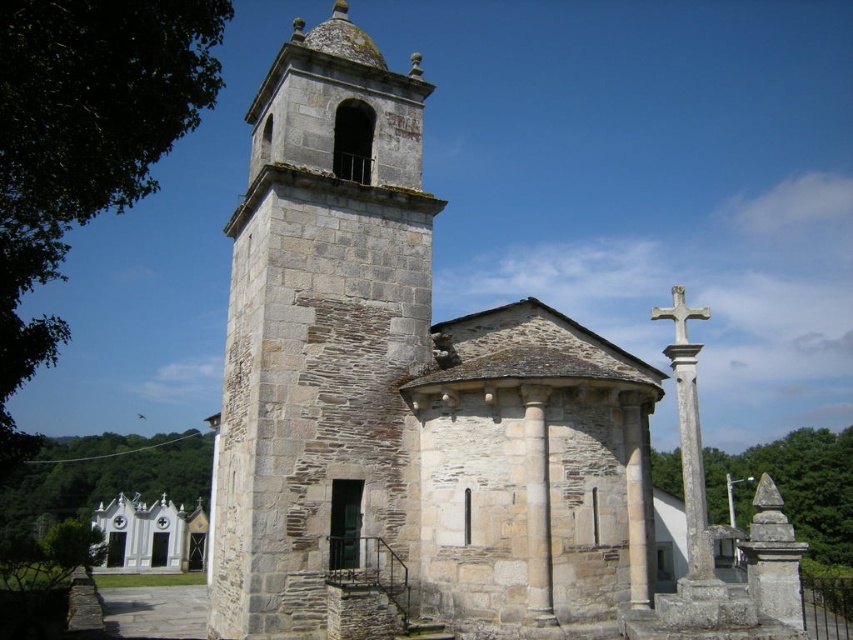
Who is taller, gray stone tower at center or white stone cross at upper right?

Standing taller between the two is gray stone tower at center.

Which is in front, point (281, 275) or point (656, 314)?

Point (656, 314)

The image size is (853, 640). I want to click on gray stone tower at center, so click(x=322, y=340).

Can you confirm if gray stone tower at center is wider than white painted wood at lower left?

Incorrect, gray stone tower at center's width does not surpass white painted wood at lower left's.

Does point (300, 545) come closer to viewer compared to point (195, 566)?

Yes, point (300, 545) is closer to viewer.

In order to click on gray stone tower at center in this screenshot , I will do `click(322, 340)`.

What do you see at coordinates (149, 536) in the screenshot? This screenshot has height=640, width=853. I see `white painted wood at lower left` at bounding box center [149, 536].

Between white painted wood at lower left and white stone cross at upper right, which one appears on the left side from the viewer's perspective?

white painted wood at lower left

Is point (195, 550) farther from camera compared to point (672, 328)?

No.

Locate an element on the screen. This screenshot has height=640, width=853. white painted wood at lower left is located at coordinates (149, 536).